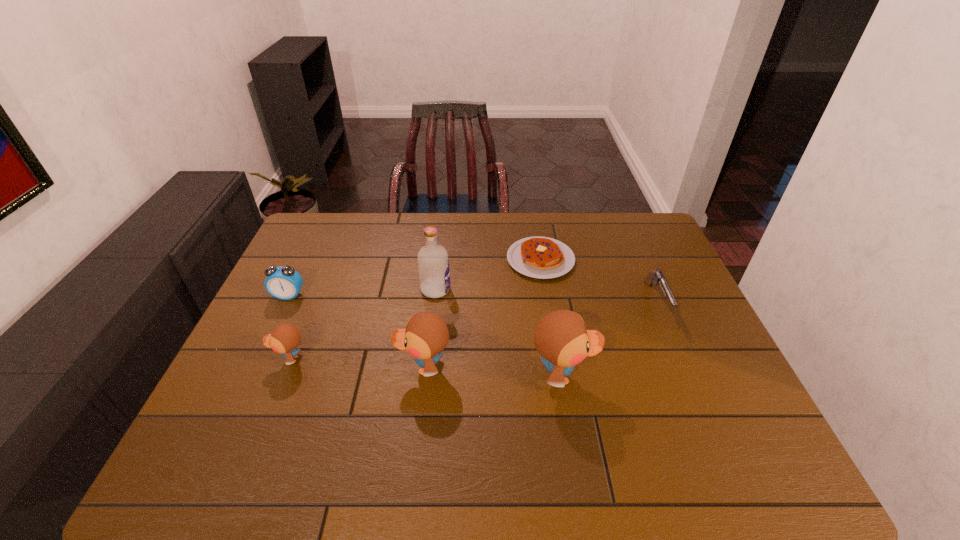
Locate an element on the screen. object that is at the right edge is located at coordinates (658, 277).

In the image, there is a desktop. Identify the location of vacant space at the far edge. (463, 241).

This screenshot has height=540, width=960. In the image, there is a desktop. Find the location of `free space at the near edge`. free space at the near edge is located at coordinates (285, 422).

Image resolution: width=960 pixels, height=540 pixels. I want to click on vacant space at the left edge of the desktop, so [310, 298].

Locate an element on the screen. This screenshot has width=960, height=540. free point at the right edge is located at coordinates [x=683, y=393].

Find the location of `blank space at the far left corner of the desktop`. blank space at the far left corner of the desktop is located at coordinates (300, 235).

What are the coordinates of `blank region between the alarm clock and the gun` in the screenshot? It's located at (472, 298).

In order to click on vacant region between the sixth tallest object and the leftmost duck in this screenshot , I will do `click(473, 330)`.

This screenshot has height=540, width=960. I want to click on unoccupied area between the rightmost duck and the vodka, so click(x=499, y=333).

Identify the location of blank region between the vodka and the leftmost duck. (363, 325).